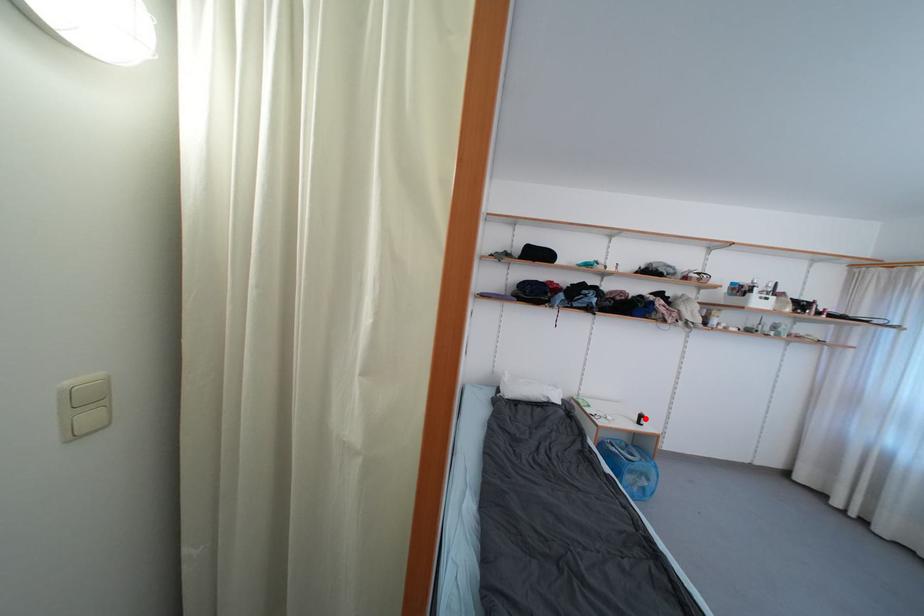
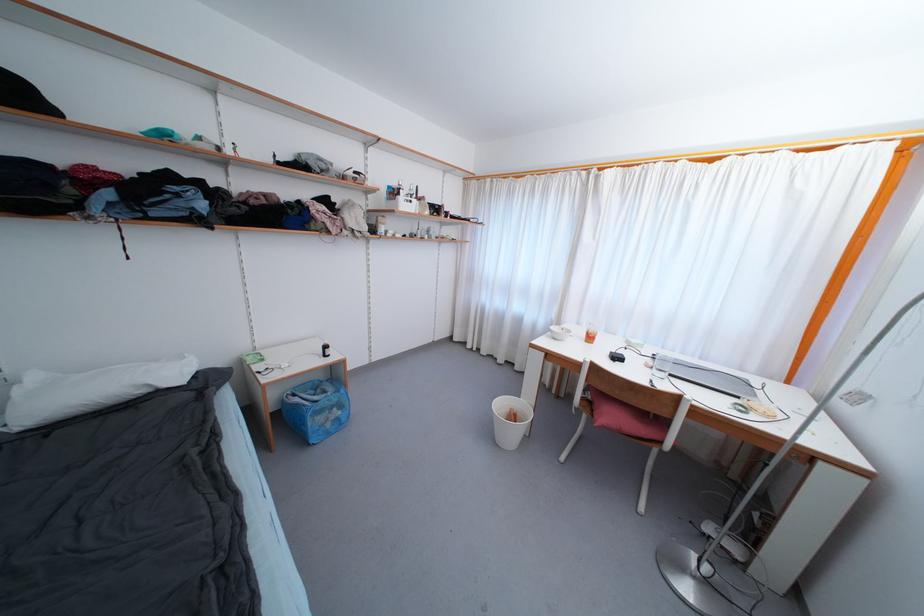
The point at the highlighted location is marked in the first image. Where is the corresponding point in the second image?

(330, 350)